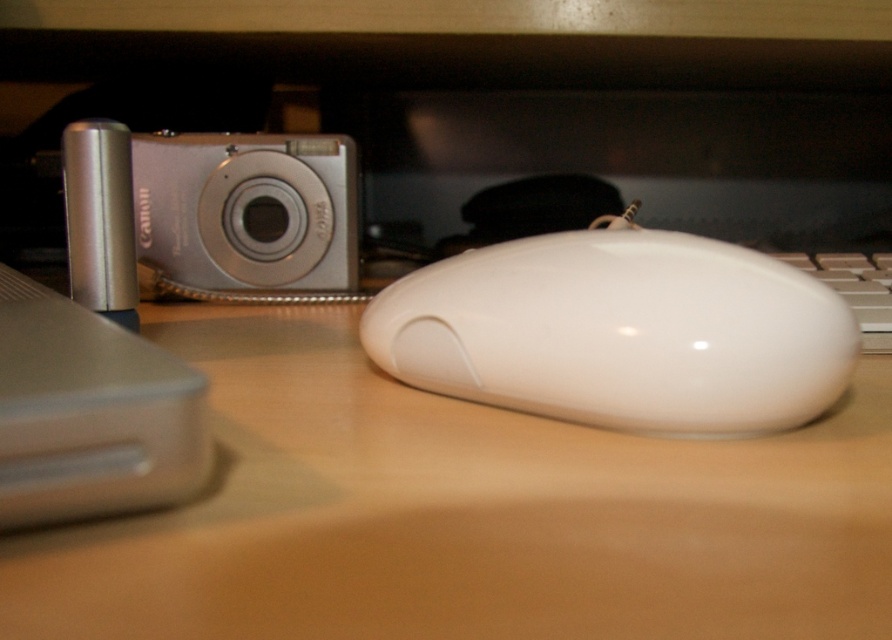
Between white glossy mouse at center and white plastic keyboard at right, which one has more height?

Standing taller between the two is white glossy mouse at center.

The image size is (892, 640). What do you see at coordinates (620, 332) in the screenshot?
I see `white glossy mouse at center` at bounding box center [620, 332].

Describe the element at coordinates (620, 332) in the screenshot. I see `white glossy mouse at center` at that location.

Find the location of a particular element. This screenshot has height=640, width=892. white glossy mouse at center is located at coordinates (620, 332).

Which is more to the right, white matte mouse at center or white glossy mouse at center?

white glossy mouse at center is more to the right.

Is white matte mouse at center above white glossy mouse at center?

No.

The image size is (892, 640). In order to click on white matte mouse at center in this screenshot , I will do `click(464, 515)`.

Which is below, white matte mouse at center or white plastic keyboard at right?

Positioned lower is white matte mouse at center.

Can you confirm if white matte mouse at center is positioned to the right of white plastic keyboard at right?

No, white matte mouse at center is not to the right of white plastic keyboard at right.

Where is `white matte mouse at center`? The width and height of the screenshot is (892, 640). white matte mouse at center is located at coordinates (464, 515).